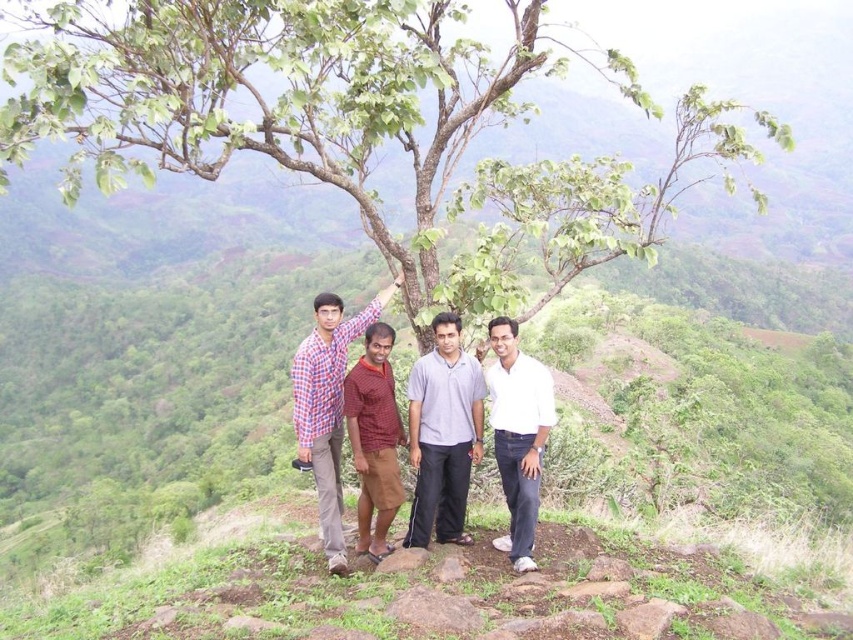
Who is shorter, checkered fabric shirt at center or white cotton shirt at center?

Standing shorter between the two is white cotton shirt at center.

Does point (334, 561) come in front of point (534, 404)?

Yes.

Who is more forward, [297,452] or [531,536]?

Point [531,536] is more forward.

Identify the location of checkered fabric shirt at center. This screenshot has height=640, width=853. (x=328, y=406).

Is green leafy tree at center to the right of checkered fabric shirt at center from the viewer's perspective?

Correct, you'll find green leafy tree at center to the right of checkered fabric shirt at center.

Between point (184, 122) and point (320, 461), which one is positioned behind?

The point (320, 461) is behind.

Image resolution: width=853 pixels, height=640 pixels. Identify the location of green leafy tree at center. pyautogui.click(x=347, y=122).

Between point (6, 154) and point (393, 428), which one is positioned in front?

Point (6, 154) is more forward.

Find the location of a particular element. green leafy tree at center is located at coordinates tap(347, 122).

Locate an element on the screen. The height and width of the screenshot is (640, 853). green leafy tree at center is located at coordinates (347, 122).